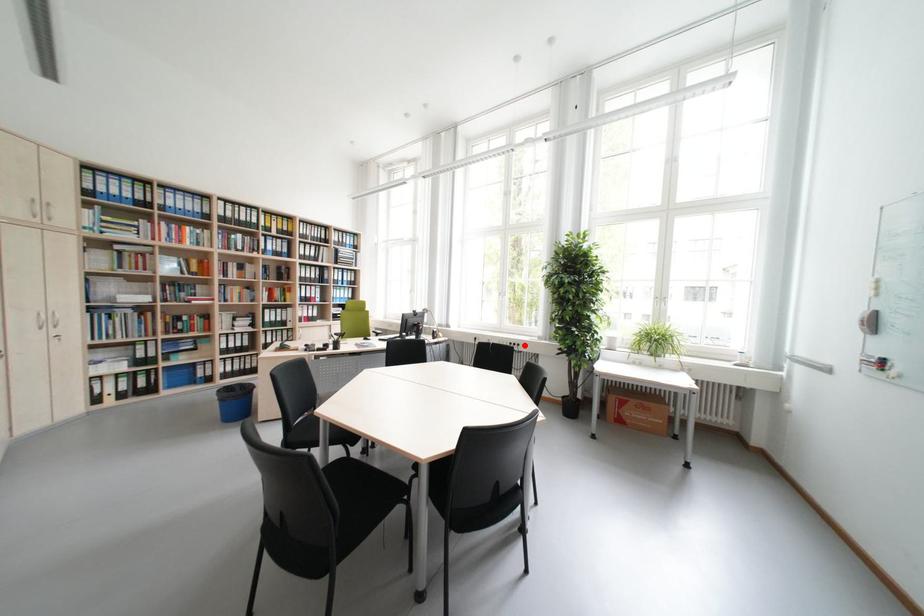
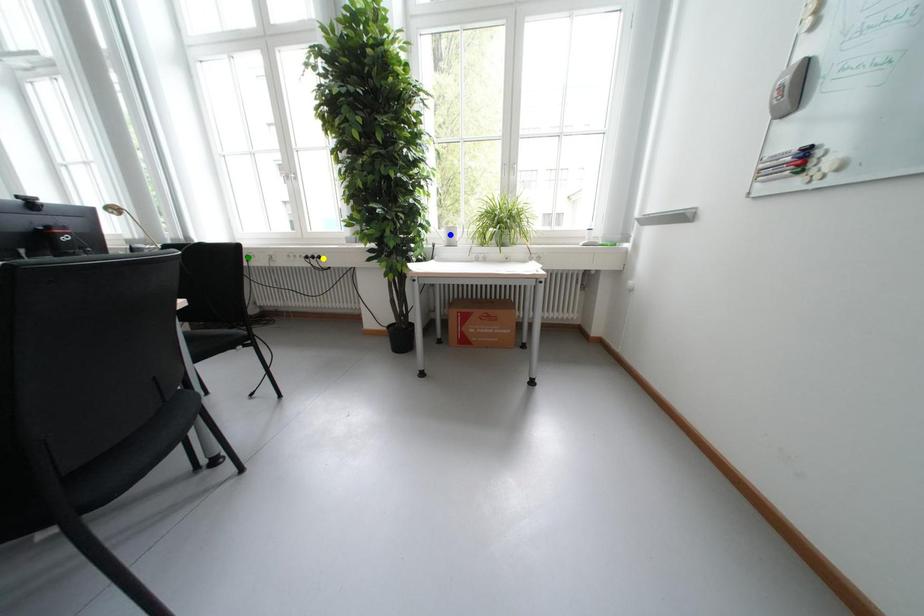
Question: I am providing you with two images of the same scene from different viewpoints. A red point is marked on the first image. You are given multiple points on the second image. In image 2, which mark is for the same physical point as the one in image 1?

Choices:
 (A) yellow point
 (B) green point
 (C) blue point

Answer: (A)